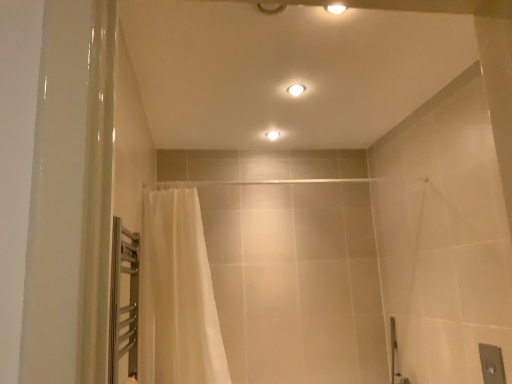
Question: From a real-world perspective, is matte white ceiling light at center, arranged as the 2th light fixture when viewed from the front, located higher than white sheer curtain at left?

Choices:
 (A) yes
 (B) no

Answer: (A)

Question: Is matte white ceiling light at center, the 1th light fixture viewed from the back, behind white sheer curtain at left?

Choices:
 (A) no
 (B) yes

Answer: (B)

Question: Can you confirm if matte white ceiling light at center, arranged as the first light fixture when viewed from the left, is thinner than white sheer curtain at left?

Choices:
 (A) yes
 (B) no

Answer: (A)

Question: Would you say matte white ceiling light at center, arranged as the first light fixture when viewed from the left, is outside white sheer curtain at left?

Choices:
 (A) yes
 (B) no

Answer: (A)

Question: Is matte white ceiling light at center, which is the 2th light fixture in right-to-left order, directly adjacent to white sheer curtain at left?

Choices:
 (A) yes
 (B) no

Answer: (B)

Question: Is matte white ceiling light at center, which is the 2th light fixture in right-to-left order, positioned with its back to white sheer curtain at left?

Choices:
 (A) yes
 (B) no

Answer: (B)

Question: Is white glossy light fixture at upper center, placed as the second light fixture when sorted from bottom to top, with matte white ceiling light at center, arranged as the 2th light fixture when viewed from the front?

Choices:
 (A) no
 (B) yes

Answer: (A)

Question: Is white glossy light fixture at upper center, the 2th light fixture from the back, positioned beyond the bounds of matte white ceiling light at center, which is the 2th light fixture from top to bottom?

Choices:
 (A) no
 (B) yes

Answer: (B)

Question: Is white glossy light fixture at upper center, which is the 1th light fixture from top to bottom, wider than matte white ceiling light at center, which is the 2th light fixture in right-to-left order?

Choices:
 (A) no
 (B) yes

Answer: (B)

Question: Could you tell me if white glossy light fixture at upper center, the 2th light fixture from the back, is facing matte white ceiling light at center, which is the 2th light fixture in right-to-left order?

Choices:
 (A) yes
 (B) no

Answer: (B)

Question: Does white glossy light fixture at upper center, acting as the first light fixture starting from the right, come behind matte white ceiling light at center, which is the 2th light fixture in right-to-left order?

Choices:
 (A) no
 (B) yes

Answer: (A)

Question: From a real-world perspective, is white glossy light fixture at upper center, acting as the first light fixture starting from the right, on matte white ceiling light at center, marked as the 1th light fixture in a bottom-to-top arrangement?

Choices:
 (A) yes
 (B) no

Answer: (A)

Question: From a real-world perspective, is white sheer curtain at left positioned over matte white ceiling light at center, marked as the 1th light fixture in a bottom-to-top arrangement, based on gravity?

Choices:
 (A) yes
 (B) no

Answer: (B)